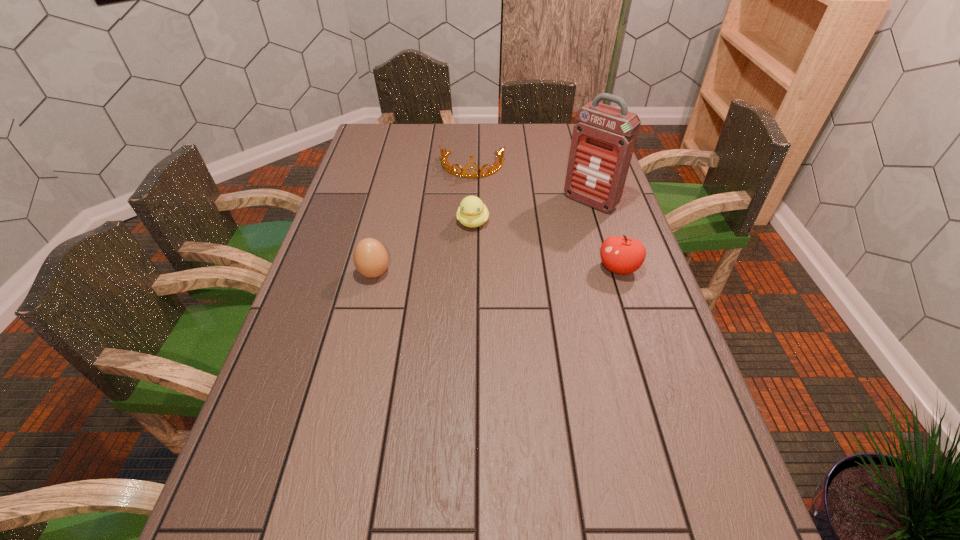
This screenshot has height=540, width=960. I want to click on free space on the desktop that is between the boiled egg and the apple and is positioned on the front-facing side of the first-aid kit, so click(517, 271).

Where is `free space on the desktop that is between the leftmost object and the apple and is positioned on the front-facing side of the tiara`? free space on the desktop that is between the leftmost object and the apple and is positioned on the front-facing side of the tiara is located at coordinates (467, 272).

At what (x,y) coordinates should I click in order to perform the action: click on free space on the desktop that is between the leftmost object and the apple and is positioned at the beak of the duckling. Please return your answer as a coordinate pair (x, y). Looking at the image, I should click on (463, 272).